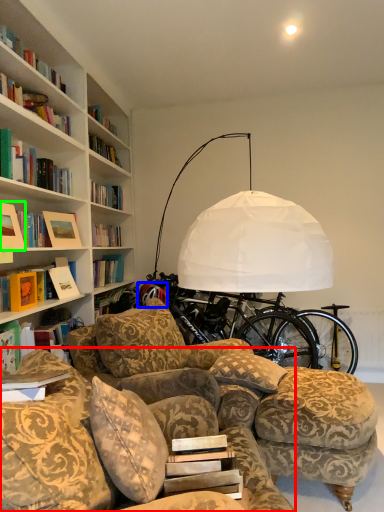
Question: Which is farther away from studio couch (highlighted by a red box)? wheel (highlighted by a blue box) or picture frame (highlighted by a green box)?

Choices:
 (A) wheel
 (B) picture frame

Answer: (A)